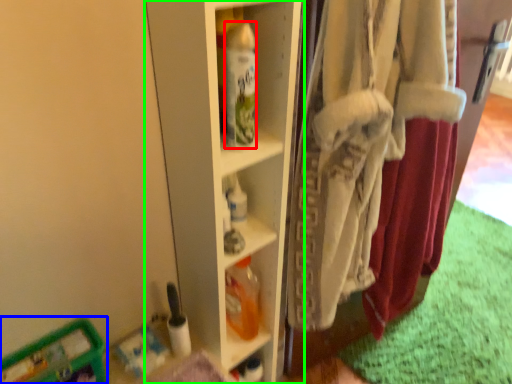
Question: Which is nearer to the bottle (highlighted by a red box)? wide (highlighted by a blue box) or shelf (highlighted by a green box).

Choices:
 (A) wide
 (B) shelf

Answer: (B)